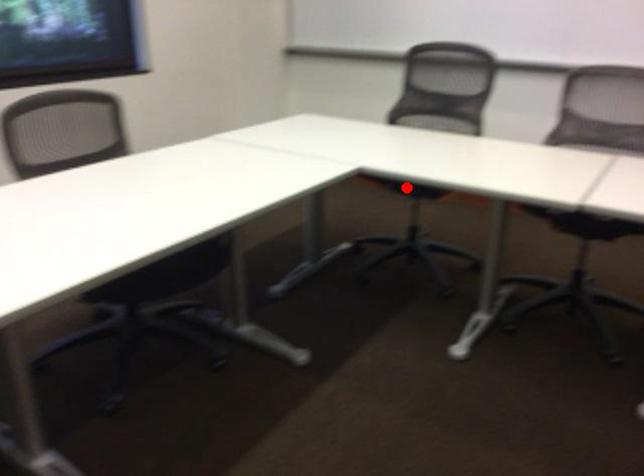
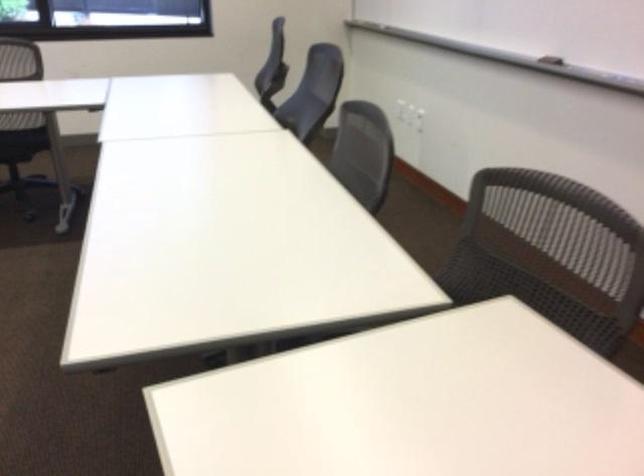
Question: I am providing you with two images of the same scene from different viewpoints. A red point is marked on the first image. At the location where the point appears in image 1, is it still visible in image 2?

Choices:
 (A) Yes
 (B) No

Answer: (B)